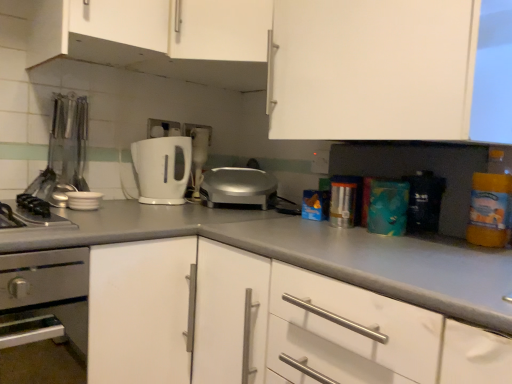
Find the location of `empty space that is to the right of white glossy bowls at left, which is counted as the second appliance, starting from the left`. empty space that is to the right of white glossy bowls at left, which is counted as the second appliance, starting from the left is located at coordinates (137, 209).